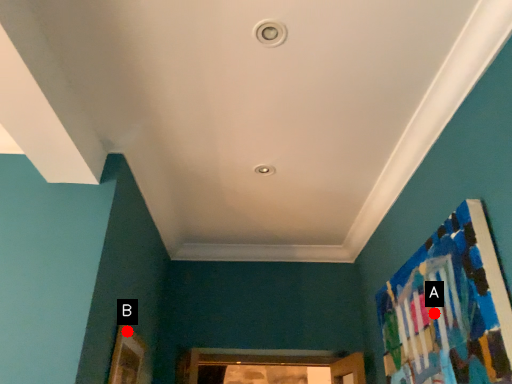
Question: Two points are circled on the image, labeled by A and B beside each circle. Which of the following is the closest to the observer?

Choices:
 (A) A is closer
 (B) B is closer

Answer: (A)